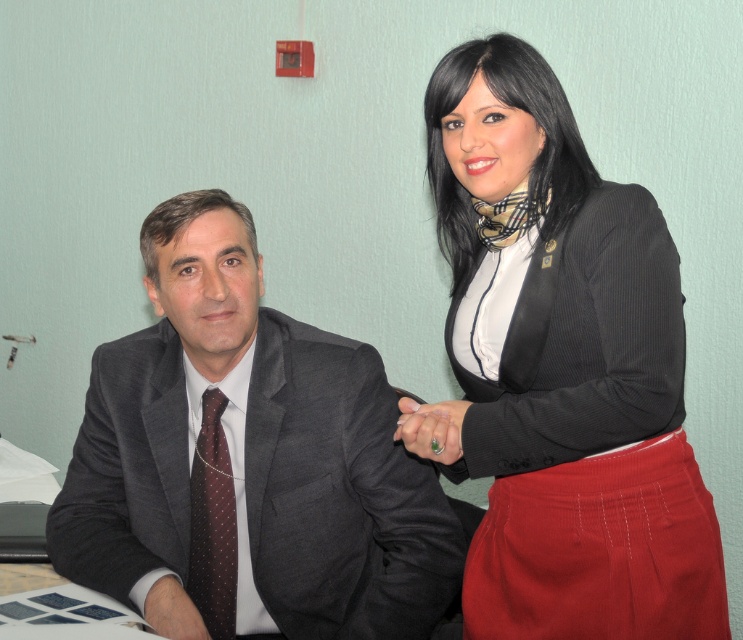
You are an interior designer observing this scene. You need to place a small decorative item between the dark gray suit at left and the green polished ring at center. Based on their positions, where should you place the item to ensure it is equidistant from both?

The dark gray suit at left is located below the green polished ring at center. To place the item equidistant between them, position it halfway between the two along the vertical axis, directly in line with their horizontal positions.

You are standing in the room and want to place a small decoration between the two points, point (418, 442) and point (152, 602). Which point should the decoration be closer to in order to be nearer to the viewer?

The decoration should be closer to point (418, 442) because it is nearer to the viewer than point (152, 602).

You are a guest at a formal event and notice the green polished ring at center and the matte black suit at lower left. Which object is positioned higher in the image?

The green polished ring at center is positioned higher than the matte black suit at lower left.